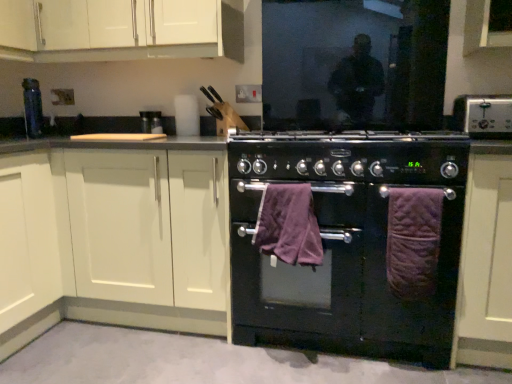
Locate an element on the screen. Image resolution: width=512 pixels, height=384 pixels. silver metallic toaster at upper right is located at coordinates (484, 116).

Image resolution: width=512 pixels, height=384 pixels. What do you see at coordinates (484, 116) in the screenshot?
I see `silver metallic toaster at upper right` at bounding box center [484, 116].

Measure the distance between point (155, 127) and camera.

Point (155, 127) is 7.63 feet away from camera.

The width and height of the screenshot is (512, 384). Identify the location of purple quilted bath towel at right, which is the first bath towel in right-to-left order. (413, 240).

Locate an element on the screen. black matte oven at center is located at coordinates (354, 243).

Locate an element on the screen. matte white cabinet at right, the 1th cabinetry in the right-to-left sequence is located at coordinates (485, 266).

Does purple plush bath towel at center, which appears as the second bath towel when viewed from the right, have a lesser width compared to matte black knife block at upper center, marked as the first appliance in a left-to-right arrangement?

Incorrect, the width of purple plush bath towel at center, which appears as the second bath towel when viewed from the right, is not less than that of matte black knife block at upper center, marked as the first appliance in a left-to-right arrangement.

From a real-world perspective, relative to matte black knife block at upper center, marked as the first appliance in a left-to-right arrangement, is purple plush bath towel at center, which appears as the 1th bath towel when viewed from the left, vertically above or below?

purple plush bath towel at center, which appears as the 1th bath towel when viewed from the left, is situated lower than matte black knife block at upper center, marked as the first appliance in a left-to-right arrangement, in the real world.

Is purple plush bath towel at center, which appears as the 1th bath towel when viewed from the left, oriented towards matte black knife block at upper center, positioned as the first appliance in top-to-bottom order?

No, purple plush bath towel at center, which appears as the 1th bath towel when viewed from the left, is not facing towards matte black knife block at upper center, positioned as the first appliance in top-to-bottom order.

Which object is further away from the camera, purple plush bath towel at center, which appears as the 1th bath towel when viewed from the left, or matte black knife block at upper center, positioned as the first appliance in top-to-bottom order?

matte black knife block at upper center, positioned as the first appliance in top-to-bottom order, is more distant.

Looking at their sizes, would you say white matte cabinet at upper left, arranged as the 2th cabinetry when viewed from the left, is wider or thinner than purple quilted bath towel at right, which is the first bath towel in right-to-left order?

Considering their sizes, white matte cabinet at upper left, arranged as the 2th cabinetry when viewed from the left, looks broader than purple quilted bath towel at right, which is the first bath towel in right-to-left order.

Find the location of a particular element. This screenshot has width=512, height=384. cabinetry that is the 2nd object located behind the purple quilted bath towel at right, acting as the second bath towel starting from the left is located at coordinates (151, 45).

From the picture: Which of these two, white matte cabinet at upper left, arranged as the 2th cabinetry when viewed from the right, or purple quilted bath towel at right, which is the first bath towel in right-to-left order, is bigger?

Bigger between the two is white matte cabinet at upper left, arranged as the 2th cabinetry when viewed from the right.

Is black matte oven at center not within purple quilted bath towel at right, acting as the second bath towel starting from the left?

Yes, black matte oven at center is not within purple quilted bath towel at right, acting as the second bath towel starting from the left.

Between black matte oven at center and purple quilted bath towel at right, acting as the second bath towel starting from the left, which one has larger size?

With larger size is black matte oven at center.

Can you confirm if black matte oven at center is thinner than purple quilted bath towel at right, acting as the second bath towel starting from the left?

Incorrect, the width of black matte oven at center is not less than that of purple quilted bath towel at right, acting as the second bath towel starting from the left.

Is black matte oven at center directly adjacent to purple quilted bath towel at right, which is the first bath towel in right-to-left order?

No, black matte oven at center is not in contact with purple quilted bath towel at right, which is the first bath towel in right-to-left order.

The height and width of the screenshot is (384, 512). I want to click on cabinetry above the purple plush bath towel at center, which appears as the second bath towel when viewed from the right (from a real-world perspective), so click(151, 45).

Is white matte cabinet at upper left, arranged as the 2th cabinetry when viewed from the right, taller or shorter than purple plush bath towel at center, which appears as the 1th bath towel when viewed from the left?

Clearly, white matte cabinet at upper left, arranged as the 2th cabinetry when viewed from the right, is taller compared to purple plush bath towel at center, which appears as the 1th bath towel when viewed from the left.

Considering the sizes of white matte cabinet at upper left, arranged as the 2th cabinetry when viewed from the left, and purple plush bath towel at center, which appears as the second bath towel when viewed from the right, in the image, is white matte cabinet at upper left, arranged as the 2th cabinetry when viewed from the left, bigger or smaller than purple plush bath towel at center, which appears as the second bath towel when viewed from the right,?

white matte cabinet at upper left, arranged as the 2th cabinetry when viewed from the left, is bigger than purple plush bath towel at center, which appears as the second bath towel when viewed from the right.

Is matte white cabinet at left, the 3th cabinetry in the right-to-left sequence, oriented away from black matte oven at center?

No, black matte oven at center is not at the back of matte white cabinet at left, the 3th cabinetry in the right-to-left sequence.

From a real-world perspective, between matte white cabinet at left, the 3th cabinetry in the right-to-left sequence, and black matte oven at center, who is vertically lower?

From a 3D spatial view, black matte oven at center is below.

In terms of size, does matte white cabinet at left, the 3th cabinetry in the right-to-left sequence, appear bigger or smaller than black matte oven at center?

matte white cabinet at left, the 3th cabinetry in the right-to-left sequence, is bigger than black matte oven at center.

From a real-world perspective, between white matte cabinet at upper left, arranged as the 2th cabinetry when viewed from the right, and matte white cabinet at left, positioned as the 1th cabinetry in left-to-right order, who is vertically lower?

matte white cabinet at left, positioned as the 1th cabinetry in left-to-right order, from a real-world perspective.

Is white matte cabinet at upper left, arranged as the 2th cabinetry when viewed from the left, further to camera compared to matte white cabinet at left, the 3th cabinetry in the right-to-left sequence?

Yes, it is.

Does white matte cabinet at upper left, arranged as the 2th cabinetry when viewed from the right, appear on the right side of matte white cabinet at left, the 3th cabinetry in the right-to-left sequence?

Yes, white matte cabinet at upper left, arranged as the 2th cabinetry when viewed from the right, is to the right of matte white cabinet at left, the 3th cabinetry in the right-to-left sequence.

From the image's perspective, which is below, white matte cabinet at upper left, arranged as the 2th cabinetry when viewed from the right, or matte white cabinet at left, the 3th cabinetry in the right-to-left sequence?

matte white cabinet at left, the 3th cabinetry in the right-to-left sequence, from the image's perspective.

Is matte black knife block at upper center, placed as the second appliance when sorted from bottom to top, far from black matte oven at center?

A: Indeed, matte black knife block at upper center, placed as the second appliance when sorted from bottom to top, is not near black matte oven at center.

What's the angular difference between matte black knife block at upper center, marked as the first appliance in a left-to-right arrangement, and black matte oven at center's facing directions?

The facing directions of matte black knife block at upper center, marked as the first appliance in a left-to-right arrangement, and black matte oven at center are 0.654 degrees apart.

Between matte black knife block at upper center, acting as the second appliance starting from the front, and black matte oven at center, which one has smaller width?

With smaller width is matte black knife block at upper center, acting as the second appliance starting from the front.

How distant is matte black knife block at upper center, marked as the first appliance in a left-to-right arrangement, from black matte oven at center?

A distance of 3.93 feet exists between matte black knife block at upper center, marked as the first appliance in a left-to-right arrangement, and black matte oven at center.

Find the location of `the 1st bath towel located beneath the matte black knife block at upper center, the 1th appliance when ordered from back to front (from a real-world perspective)`. the 1st bath towel located beneath the matte black knife block at upper center, the 1th appliance when ordered from back to front (from a real-world perspective) is located at coordinates (289, 225).

This screenshot has width=512, height=384. Identify the location of cabinetry above the purple quilted bath towel at right, acting as the second bath towel starting from the left (from a real-world perspective). tap(151, 45).

Based on their spatial positions, is matte white cabinet at left, the 3th cabinetry in the right-to-left sequence, or silver metallic toaster at upper right closer to purple quilted bath towel at right, which is the first bath towel in right-to-left order?

The object closer to purple quilted bath towel at right, which is the first bath towel in right-to-left order, is silver metallic toaster at upper right.

From the image, which object appears to be farther from black matte oven at center, acting as the second appliance starting from the back, matte white cabinet at left, positioned as the 1th cabinetry in left-to-right order, or black matte oven at center?

matte white cabinet at left, positioned as the 1th cabinetry in left-to-right order, is positioned further to the anchor black matte oven at center, acting as the second appliance starting from the back.

Based on their spatial positions, is black matte oven at center or purple quilted bath towel at right, acting as the second bath towel starting from the left, closer to purple plush bath towel at center, which appears as the second bath towel when viewed from the right?

Based on the image, black matte oven at center appears to be nearer to purple plush bath towel at center, which appears as the second bath towel when viewed from the right.

Estimate the real-world distances between objects in this image. Which object is closer to purple plush bath towel at center, which appears as the 1th bath towel when viewed from the left, matte white cabinet at left, positioned as the 1th cabinetry in left-to-right order, or matte black knife block at upper center, acting as the second appliance starting from the front?

matte white cabinet at left, positioned as the 1th cabinetry in left-to-right order, is positioned closer to the anchor purple plush bath towel at center, which appears as the 1th bath towel when viewed from the left.

Considering their positions, is black matte oven at center positioned closer to purple quilted bath towel at right, acting as the second bath towel starting from the left, than silver metallic toaster at upper right?

black matte oven at center is positioned closer to the anchor purple quilted bath towel at right, acting as the second bath towel starting from the left.

Estimate the real-world distances between objects in this image. Which object is further from black matte oven at center, acting as the second appliance starting from the back, purple plush bath towel at center, which appears as the second bath towel when viewed from the right, or white matte cabinet at upper left, arranged as the 2th cabinetry when viewed from the right?

The object further to black matte oven at center, acting as the second appliance starting from the back, is white matte cabinet at upper left, arranged as the 2th cabinetry when viewed from the right.

Which object lies further to the anchor point black matte oven at center, white matte cabinet at upper left, arranged as the 2th cabinetry when viewed from the right, or silver metallic toaster at upper right?

white matte cabinet at upper left, arranged as the 2th cabinetry when viewed from the right, is further to black matte oven at center.

Considering their positions, is black matte oven at center positioned further to white matte cabinet at upper left, arranged as the 2th cabinetry when viewed from the left, than black matte oven at center, acting as the second appliance starting from the back?

The object further to white matte cabinet at upper left, arranged as the 2th cabinetry when viewed from the left, is black matte oven at center.

This screenshot has width=512, height=384. In order to click on bath towel between black matte oven at center, the first appliance positioned from the front, and matte white cabinet at right, which is the third cabinetry in left-to-right order, from left to right in this screenshot , I will do `click(413, 240)`.

Find the location of a particular element. This screenshot has height=384, width=512. cabinetry situated between matte white cabinet at left, the 3th cabinetry in the right-to-left sequence, and matte white cabinet at right, which is the third cabinetry in left-to-right order, from left to right is located at coordinates (151, 45).

Image resolution: width=512 pixels, height=384 pixels. I want to click on bath towel between purple plush bath towel at center, which appears as the 1th bath towel when viewed from the left, and matte white cabinet at right, the 1th cabinetry in the right-to-left sequence, in the horizontal direction, so click(x=413, y=240).

Where is `appliance situated between purple plush bath towel at center, which appears as the second bath towel when viewed from the right, and purple quilted bath towel at right, which is the first bath towel in right-to-left order, from left to right`? The image size is (512, 384). appliance situated between purple plush bath towel at center, which appears as the second bath towel when viewed from the right, and purple quilted bath towel at right, which is the first bath towel in right-to-left order, from left to right is located at coordinates (351, 157).